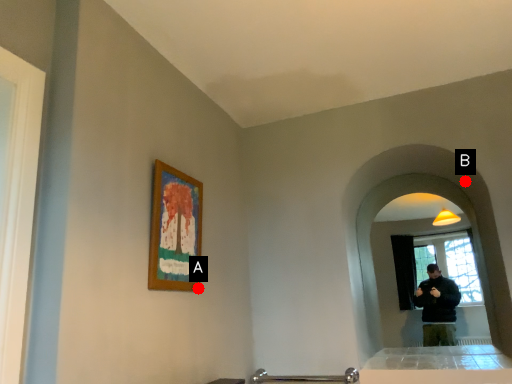
Question: Two points are circled on the image, labeled by A and B beside each circle. Which point is closer to the camera?

Choices:
 (A) A is closer
 (B) B is closer

Answer: (A)